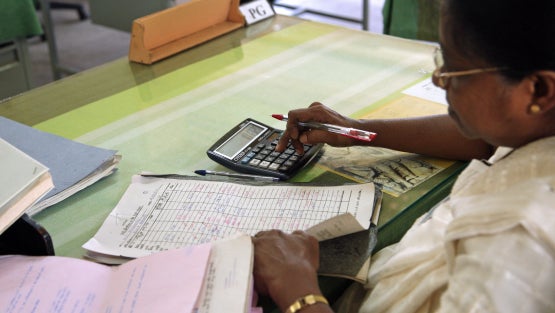
This screenshot has width=555, height=313. In order to click on metal chair legs in this screenshot , I will do `click(26, 61)`.